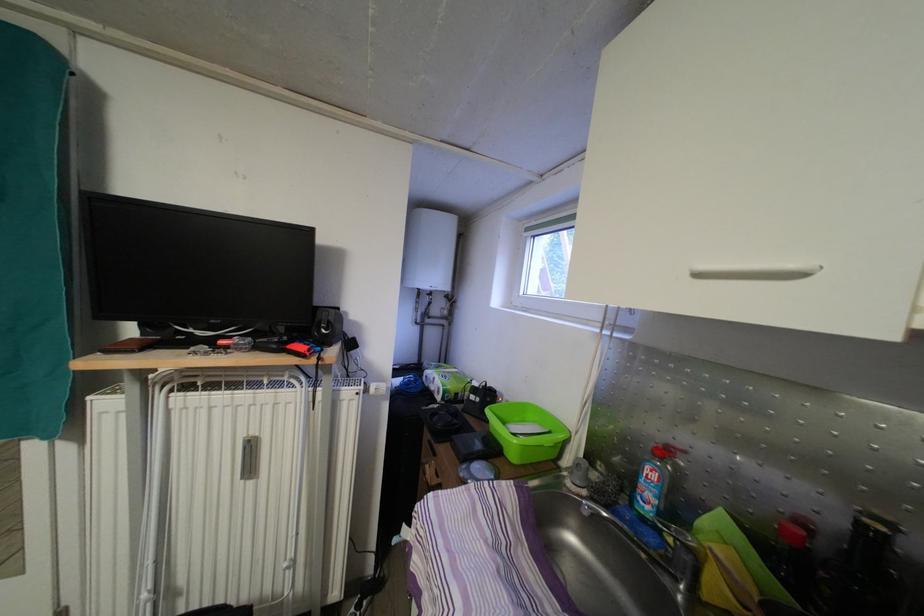
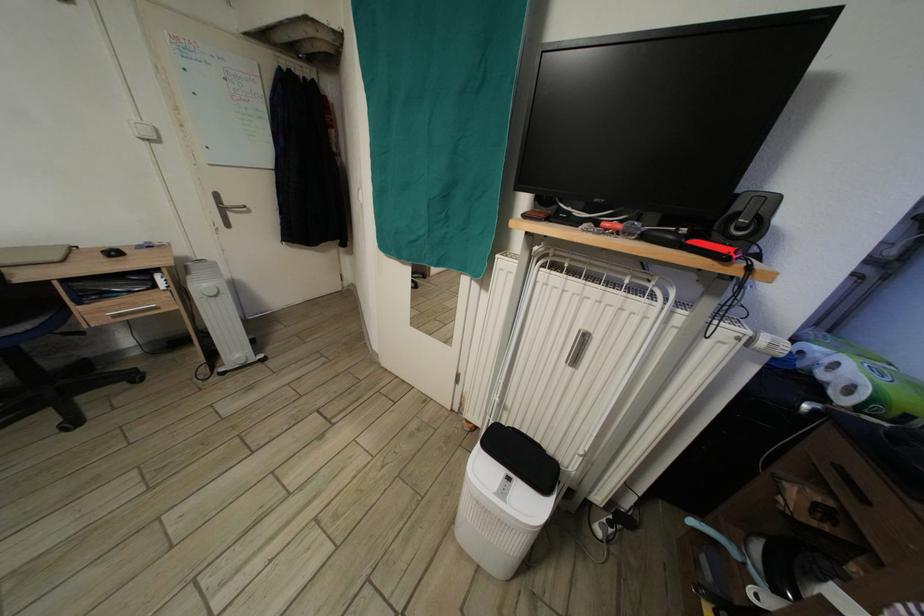
In the second image, find the point that corresponds to point 198,337 in the first image.

(576, 216)